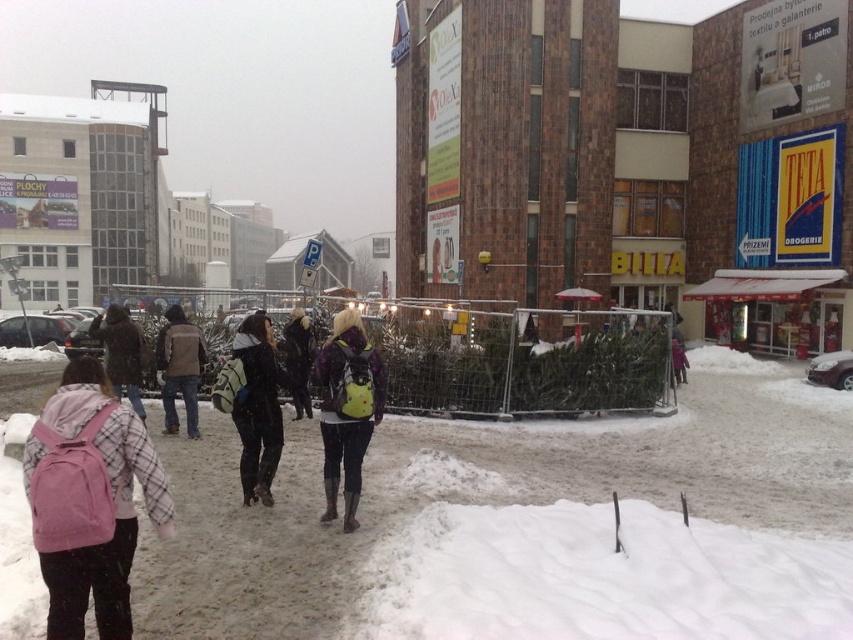
Does white fluffy snow at lower left have a smaller size compared to pink backpack at left?

Actually, white fluffy snow at lower left might be larger than pink backpack at left.

Is point (402, 524) positioned before point (100, 336)?

Yes, it is.

Locate an element on the screen. white fluffy snow at lower left is located at coordinates (506, 522).

Does matte yellow backpack at center appear over dark blue jeans at center?

Actually, matte yellow backpack at center is below dark blue jeans at center.

Between matte yellow backpack at center and dark blue jeans at center, which one has less height?

dark blue jeans at center

Between point (337, 380) and point (241, 449), which one is positioned behind?

The point (241, 449) is more distant.

At what (x,y) coordinates should I click in order to perform the action: click on matte yellow backpack at center. Please return your answer as a coordinate pair (x, y). Looking at the image, I should click on (x=347, y=410).

Who is higher up, white fluffy snow at lower left or pink fabric backpack at left?

pink fabric backpack at left is higher up.

Is point (233, 541) in front of point (102, 452)?

No, (233, 541) is behind (102, 452).

Locate an element on the screen. This screenshot has height=640, width=853. white fluffy snow at lower left is located at coordinates (506, 522).